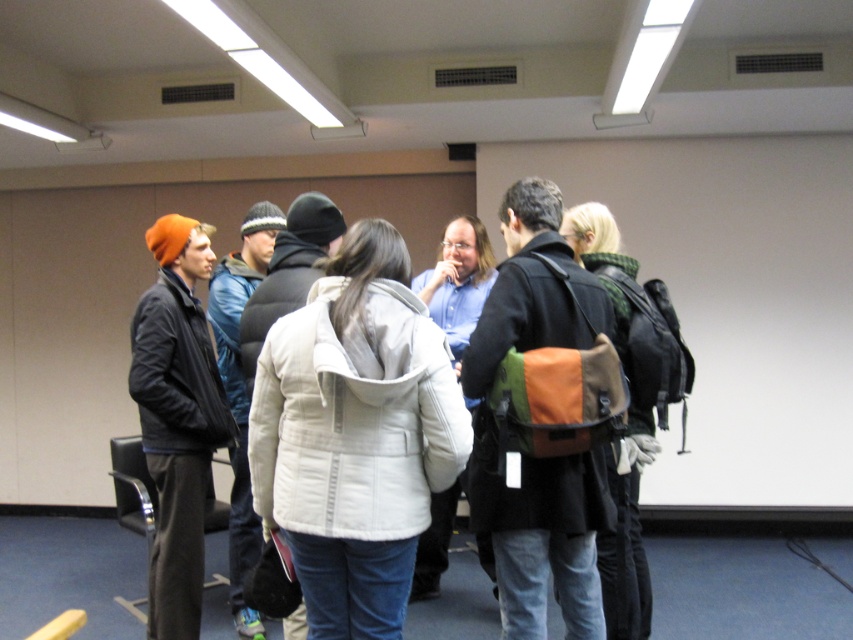
You are organizing a photo shoot and need to arrange two jackets for a fashion spread. The white puffy jacket at center and the matte black jacket at left are available. If you want to emphasize the size difference between them, which jacket should you place closer to the camera?

The white puffy jacket at center is larger in size compared to the matte black jacket at left. To emphasize their size difference, place the matte black jacket at left closer to the camera so that its smaller size appears more prominent against the larger jacket in the background.

You are organizing a group photo and need to position the orange fabric backpack at center and the matte black jacket at left correctly. Based on their positions in the scene, which object should be placed to the right when arranging them in the photo?

The orange fabric backpack at center should be placed to the right of the matte black jacket at left because the orange fabric backpack at center is to the right of matte black jacket at left in the scene.

You are standing in the conference room and want to take a photo of both point (434, 480) and point (202, 460). Which point should you focus on first to ensure both are in focus?

Point (434, 480) is closer to the camera than point (202, 460), so focus on point (434, 480) first to ensure both are in focus.